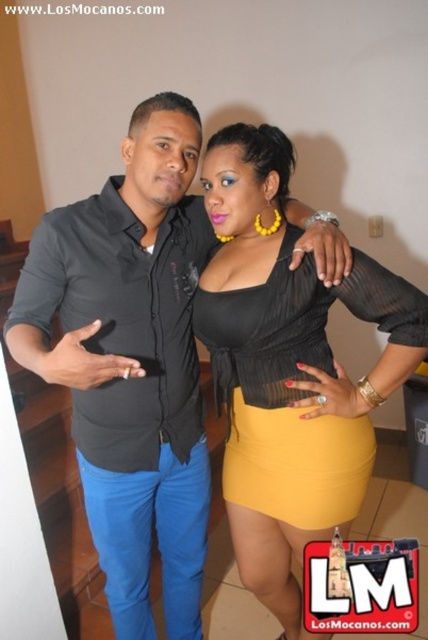
Who is more distant from viewer, (136,598) or (237,362)?

The point (136,598) is behind.

Does black matte shirt at center have a smaller size compared to matte black blouse at center?

Incorrect, black matte shirt at center is not smaller in size than matte black blouse at center.

Locate an element on the screen. This screenshot has width=428, height=640. black matte shirt at center is located at coordinates (130, 360).

The width and height of the screenshot is (428, 640). In order to click on black matte shirt at center in this screenshot , I will do `click(130, 360)`.